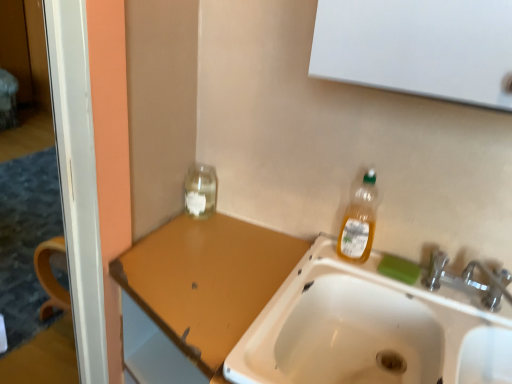
Identify the location of vacant region in front of translucent plastic bottle at upper right. The width and height of the screenshot is (512, 384). (361, 276).